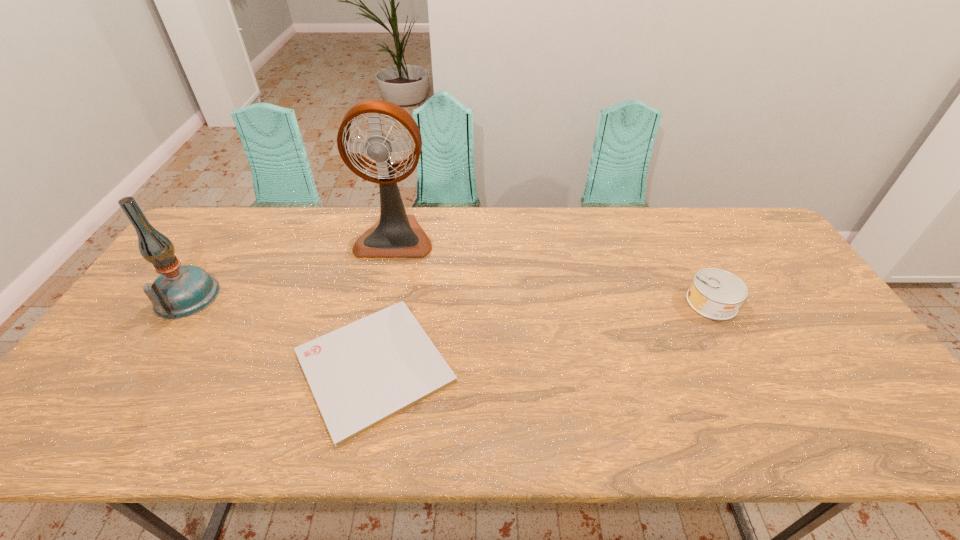
Find the location of a particular element. the farthest object is located at coordinates (396, 234).

The height and width of the screenshot is (540, 960). I want to click on fan, so click(396, 234).

The width and height of the screenshot is (960, 540). I want to click on the leftmost object, so click(180, 291).

At what (x,y) coordinates should I click in order to perform the action: click on oil lamp. Please return your answer as a coordinate pair (x, y). The image size is (960, 540). Looking at the image, I should click on (180, 291).

Where is `can`? can is located at coordinates (716, 294).

At what (x,y) coordinates should I click in order to perform the action: click on the rightmost object. Please return your answer as a coordinate pair (x, y). The height and width of the screenshot is (540, 960). Looking at the image, I should click on (716, 294).

I want to click on the shortest object, so click(364, 373).

This screenshot has height=540, width=960. Find the location of `free region located on the front-facing side of the fan`. free region located on the front-facing side of the fan is located at coordinates (369, 355).

Find the location of a particular element. This screenshot has height=540, width=960. vacant space located on the back of the oil lamp is located at coordinates (237, 219).

The image size is (960, 540). I want to click on blank space located 0.130m on the back of the can, so click(688, 256).